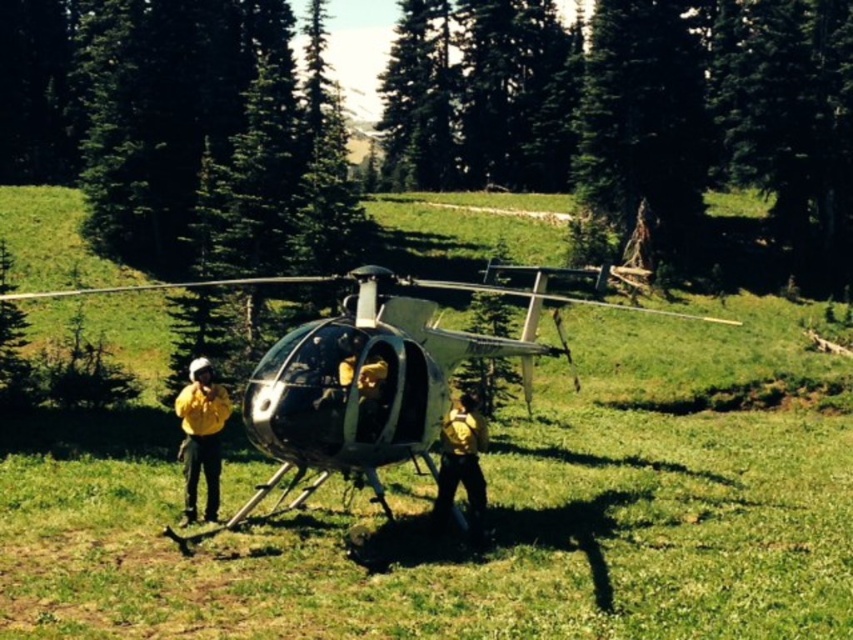
Is point (209, 483) farther from camera compared to point (444, 429)?

Yes, it is behind point (444, 429).

Is the position of yellow fireproof suit at left less distant than that of matte yellow backpack at center?

No, it is not.

I want to click on yellow fireproof suit at left, so click(x=201, y=436).

Based on the photo, who is taller, metallic silver helicopter at center or matte yellow backpack at center?

metallic silver helicopter at center is taller.

I want to click on metallic silver helicopter at center, so click(x=370, y=372).

Does metallic silver helicopter at center appear over yellow fireproof suit at left?

Correct, metallic silver helicopter at center is located above yellow fireproof suit at left.

Can you confirm if metallic silver helicopter at center is positioned to the right of yellow fireproof suit at left?

Yes, metallic silver helicopter at center is to the right of yellow fireproof suit at left.

What do you see at coordinates (370, 372) in the screenshot? I see `metallic silver helicopter at center` at bounding box center [370, 372].

At what (x,y) coordinates should I click in order to perform the action: click on metallic silver helicopter at center. Please return your answer as a coordinate pair (x, y). Looking at the image, I should click on (370, 372).